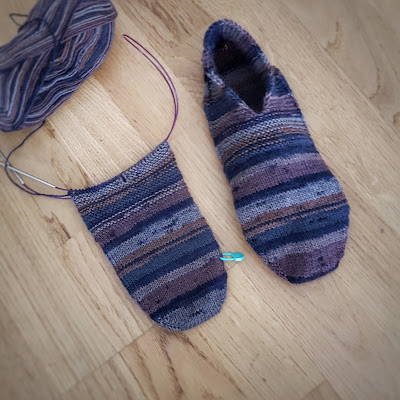
Where is `skein of multicolored yarn`? skein of multicolored yarn is located at coordinates (74, 68).